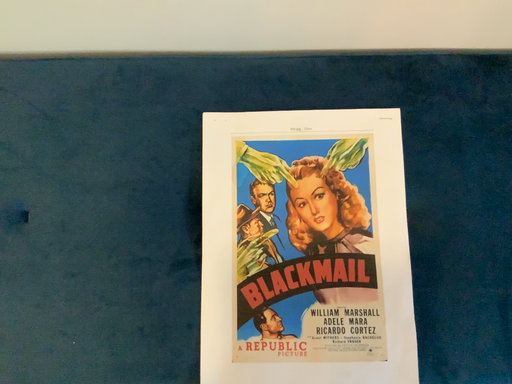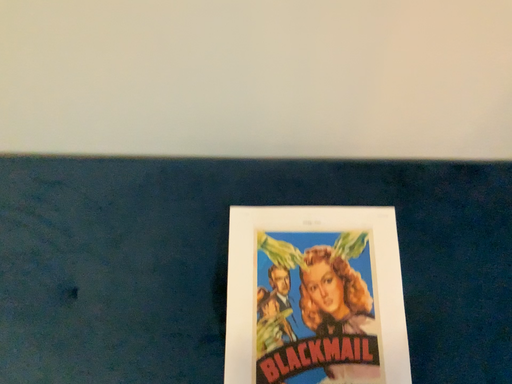
Question: How did the camera likely rotate when shooting the video?

Choices:
 (A) rotated downward
 (B) rotated upward

Answer: (B)